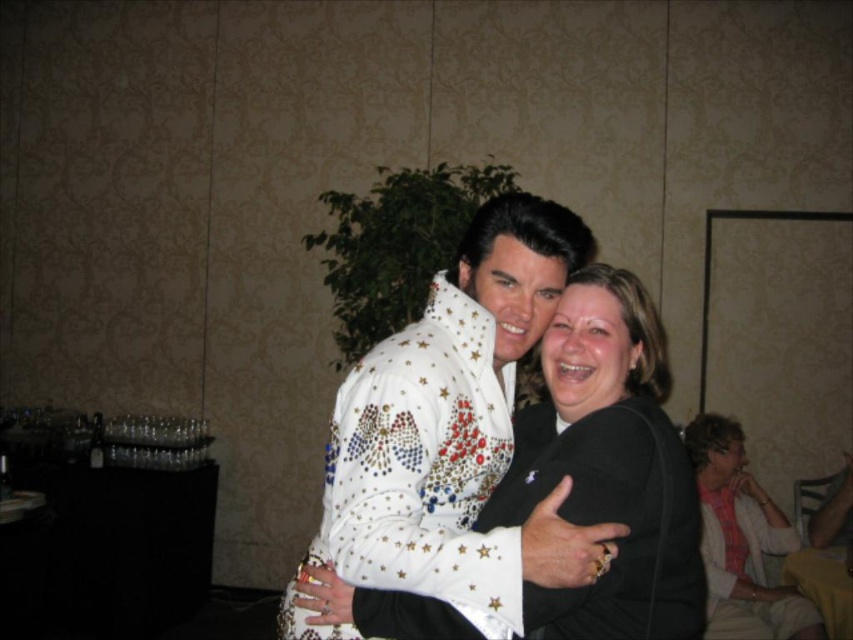
You are standing at point point [532,461] and want to take a photo of the two people in the scene. The camera you have can focus on subjects within 1.5 meters. Will the camera be able to focus on them?

The distance between point [532,461] and the camera is 1.45 meters, which is within the camera focus range of 1.5 meters. Therefore, the camera can focus on them.